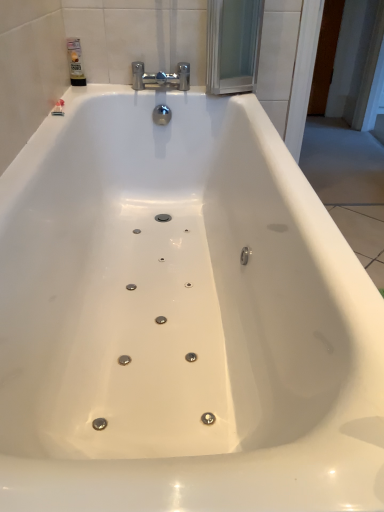
Identify the location of chrome/metallic faucet at upper center. This screenshot has width=384, height=512. (161, 77).

This screenshot has width=384, height=512. Describe the element at coordinates (161, 77) in the screenshot. I see `chrome/metallic faucet at upper center` at that location.

Locate an element on the screen. The height and width of the screenshot is (512, 384). chrome/metallic faucet at upper center is located at coordinates (161, 77).